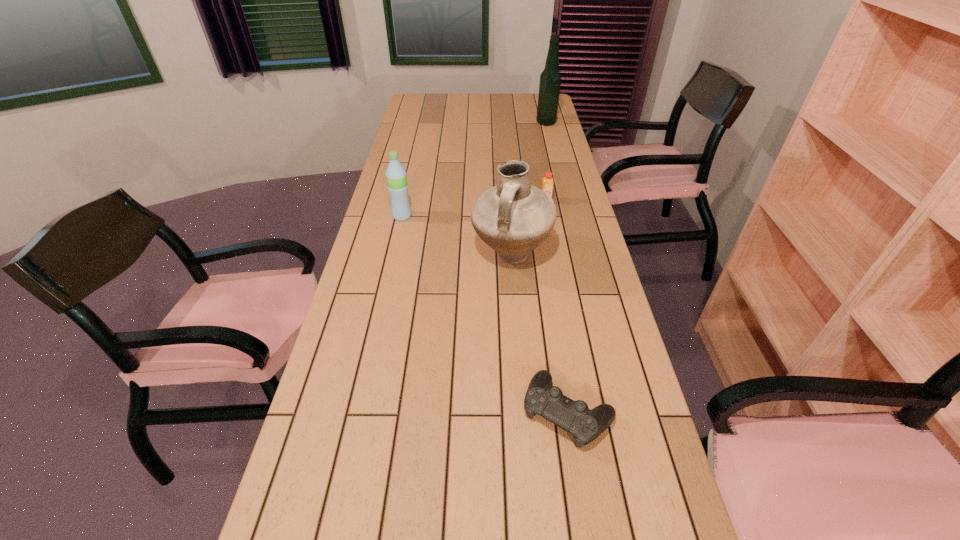
At what (x,y) coordinates should I click in order to perform the action: click on empty location between the orange juice and the nearest object. Please return your answer as a coordinate pair (x, y). Image resolution: width=960 pixels, height=540 pixels. Looking at the image, I should click on (557, 306).

Identify the location of object that can be found as the second closest to the third nearest object. (547, 186).

Identify the location of the third closest object relative to the second farthest object. (550, 79).

Image resolution: width=960 pixels, height=540 pixels. Find the location of `free location that satisfies the following two spatial constraints: 1. on the front side of the nearest object; 2. on the right side of the leftmost object`. free location that satisfies the following two spatial constraints: 1. on the front side of the nearest object; 2. on the right side of the leftmost object is located at coordinates (359, 412).

Where is `free spot that satisfies the following two spatial constraints: 1. on the back side of the alcohol; 2. on the right side of the nearest object`? The height and width of the screenshot is (540, 960). free spot that satisfies the following two spatial constraints: 1. on the back side of the alcohol; 2. on the right side of the nearest object is located at coordinates (521, 123).

Identify the location of free location that satisfies the following two spatial constraints: 1. on the front side of the control; 2. on the left side of the water bottle. This screenshot has width=960, height=540. (359, 412).